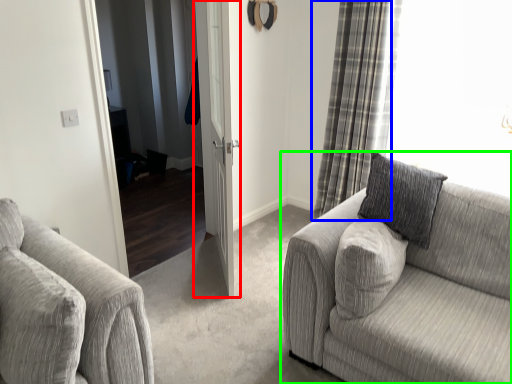
Question: Which is farther away from door (highlighted by a red box)? curtain (highlighted by a blue box) or studio couch (highlighted by a green box)?

Choices:
 (A) curtain
 (B) studio couch

Answer: (B)